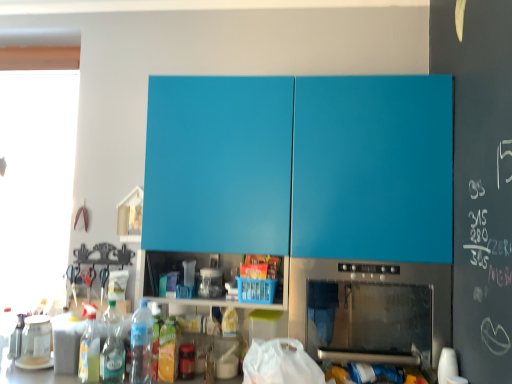
Question: Could you tell me if matte blue cabinet at upper center is turned towards transparent plastic jar at center, the first appliance when ordered from front to back?

Choices:
 (A) no
 (B) yes

Answer: (B)

Question: Considering the relative sizes of matte blue cabinet at upper center and transparent plastic jar at center, which appears as the second appliance when ordered from the bottom, in the image provided, is matte blue cabinet at upper center smaller than transparent plastic jar at center, which appears as the second appliance when ordered from the bottom,?

Choices:
 (A) no
 (B) yes

Answer: (A)

Question: Does matte blue cabinet at upper center appear on the right side of transparent plastic jar at center, the 2th appliance when ordered from left to right?

Choices:
 (A) no
 (B) yes

Answer: (B)

Question: Is matte blue cabinet at upper center located outside transparent plastic jar at center, which appears as the second appliance when ordered from the bottom?

Choices:
 (A) yes
 (B) no

Answer: (A)

Question: Are matte blue cabinet at upper center and transparent plastic jar at center, which appears as the second appliance when ordered from the bottom, located far from each other?

Choices:
 (A) yes
 (B) no

Answer: (B)

Question: From a real-world perspective, is matte blue cabinet at upper center under transparent plastic jar at center, the 2th appliance in the back-to-front sequence?

Choices:
 (A) yes
 (B) no

Answer: (B)

Question: Considering the relative positions of transparent glass jar at lower left, the second appliance when ordered from right to left, and stainless steel oven at lower center in the image provided, is transparent glass jar at lower left, the second appliance when ordered from right to left, to the right of stainless steel oven at lower center from the viewer's perspective?

Choices:
 (A) no
 (B) yes

Answer: (A)

Question: Is transparent glass jar at lower left, the 2th appliance positioned from the front, far from stainless steel oven at lower center?

Choices:
 (A) no
 (B) yes

Answer: (B)

Question: Is transparent glass jar at lower left, which is counted as the 1th appliance, starting from the left, completely or partially outside of stainless steel oven at lower center?

Choices:
 (A) yes
 (B) no

Answer: (A)

Question: Does transparent glass jar at lower left, which is counted as the 1th appliance, starting from the left, have a greater height compared to stainless steel oven at lower center?

Choices:
 (A) no
 (B) yes

Answer: (A)

Question: Are transparent glass jar at lower left, arranged as the first appliance when viewed from the back, and stainless steel oven at lower center making contact?

Choices:
 (A) no
 (B) yes

Answer: (A)

Question: From a real-world perspective, does transparent glass jar at lower left, the 2th appliance positioned from the front, sit lower than stainless steel oven at lower center?

Choices:
 (A) yes
 (B) no

Answer: (A)

Question: Does stainless steel oven at lower center have a larger size compared to matte blue cabinet at upper center?

Choices:
 (A) yes
 (B) no

Answer: (B)